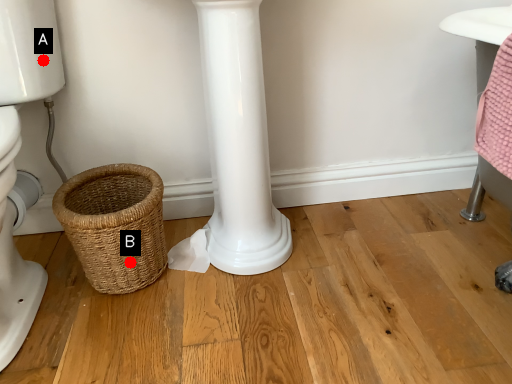
Question: Two points are circled on the image, labeled by A and B beside each circle. Which point appears farthest from the camera in this image?

Choices:
 (A) A is further
 (B) B is further

Answer: (A)